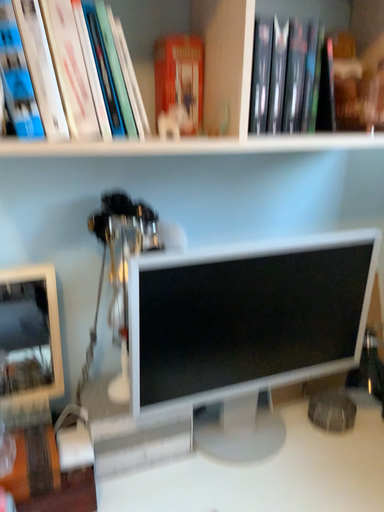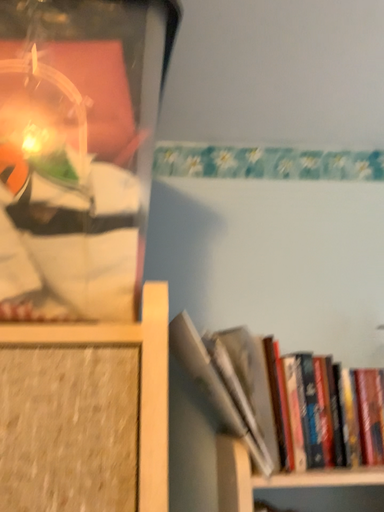
Question: How did the camera likely rotate when shooting the video?

Choices:
 (A) rotated upward
 (B) rotated downward

Answer: (A)